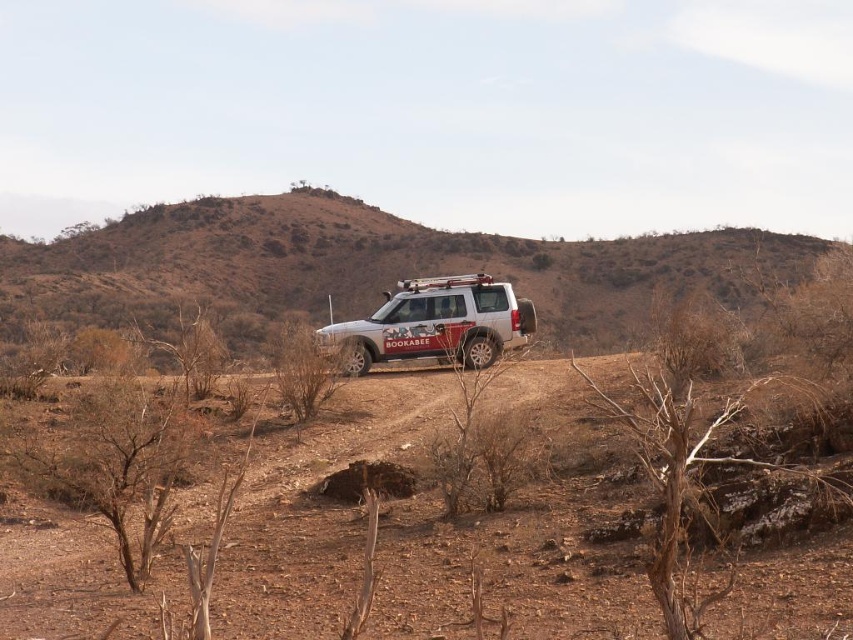
You are planning a road trip and need to know if your vehicle can pass through the narrowest point between the brown dirt hillside at center and the white matte jeep at center. The vehicle you are driving is 2 meters wide. Can you safely navigate through that area?

The brown dirt hillside at center is wider than the white matte jeep at center. However, the question is about the narrowest point between them. Since the SUV is parked between the hillside and the path, but the description only states the hillside is wider, not the distance between them. The given information does not specify the width of the path between the hillside and the jeep. Therefore, it is impossible to determine if the 2m wide vehicle can pass safely based on the provided details.

You are a hiker trying to reach the white matte jeep at center. You are currently standing on the brown dirt hillside at center. Which direction should you move to get to the jeep?

The brown dirt hillside at center is closer to you than the white matte jeep at center, so you should move away from the hillside towards the jeep.